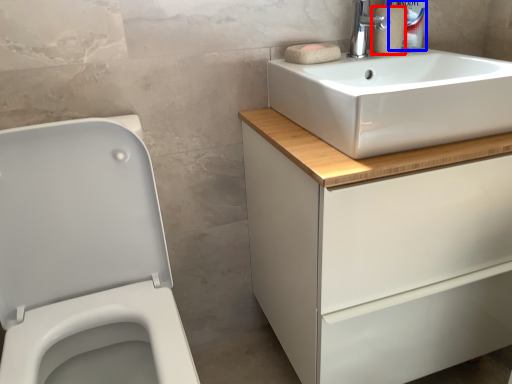
Question: Which object appears farthest to the camera in this image, toilet paper (highlighted by a red box) or cleaning product (highlighted by a blue box)?

Choices:
 (A) toilet paper
 (B) cleaning product

Answer: (B)